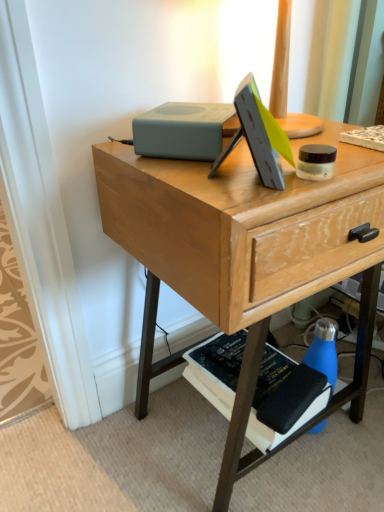
Where is `vacant space that is to the left of wooden desk at center`? vacant space that is to the left of wooden desk at center is located at coordinates (93, 446).